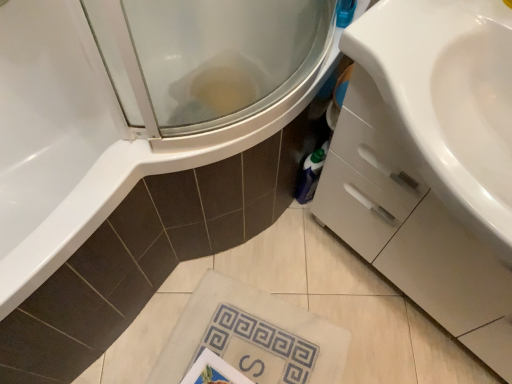
Question: Is point (387, 49) positioned closer to the camera than point (169, 365)?

Choices:
 (A) closer
 (B) farther

Answer: (A)

Question: Is white glossy cabinet at right inside the boundaries of white textured towel at lower center, or outside?

Choices:
 (A) outside
 (B) inside

Answer: (A)

Question: In terms of width, does white glossy cabinet at right look wider or thinner when compared to white textured towel at lower center?

Choices:
 (A) wide
 (B) thin

Answer: (B)

Question: In terms of height, does white textured towel at lower center look taller or shorter compared to white glossy cabinet at right?

Choices:
 (A) short
 (B) tall

Answer: (A)

Question: Considering the positions of white textured towel at lower center and white glossy cabinet at right in the image, is white textured towel at lower center wider or thinner than white glossy cabinet at right?

Choices:
 (A) thin
 (B) wide

Answer: (B)

Question: Considering their positions, is white textured towel at lower center located in front of or behind white glossy cabinet at right?

Choices:
 (A) front
 (B) behind

Answer: (B)

Question: From a real-world perspective, is white textured towel at lower center above or below white glossy cabinet at right?

Choices:
 (A) above
 (B) below

Answer: (B)